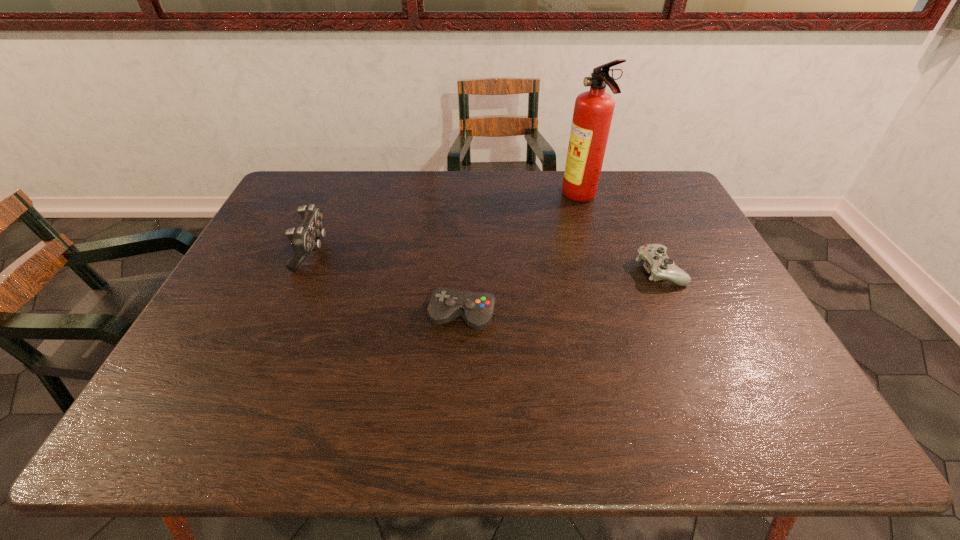
You are a GUI agent. You are given a task and a screenshot of the screen. Output one action in this format:
    pyautogui.click(x=<x>, y=<y>)
    Task: Click on the second object from right to left
    The height and width of the screenshot is (540, 960).
    Given the screenshot: What is the action you would take?
    pyautogui.click(x=593, y=110)

The height and width of the screenshot is (540, 960). Find the location of `the farthest object`. the farthest object is located at coordinates (593, 110).

You are a GUI agent. You are given a task and a screenshot of the screen. Output one action in this format:
    pyautogui.click(x=<x>, y=<y>)
    Task: Click on the leftmost control
    
    Given the screenshot: What is the action you would take?
    pyautogui.click(x=306, y=238)

The width and height of the screenshot is (960, 540). In order to click on the leftmost object in this screenshot , I will do `click(306, 238)`.

This screenshot has width=960, height=540. I want to click on the nearest object, so click(477, 309).

This screenshot has width=960, height=540. I want to click on the third object from right to left, so click(x=477, y=309).

At what (x,y) coordinates should I click in order to perform the action: click on the rightmost object. Please return your answer as a coordinate pair (x, y). The image size is (960, 540). Looking at the image, I should click on (656, 262).

Find the location of a particular element. This screenshot has height=540, width=960. free space located 0.120m on the front-facing side of the farthest object is located at coordinates (527, 198).

In order to click on free spot located on the front-facing side of the farthest object in this screenshot , I will do `click(523, 198)`.

Locate an element on the screen. This screenshot has height=540, width=960. vacant point located 0.220m on the front-facing side of the farthest object is located at coordinates (497, 198).